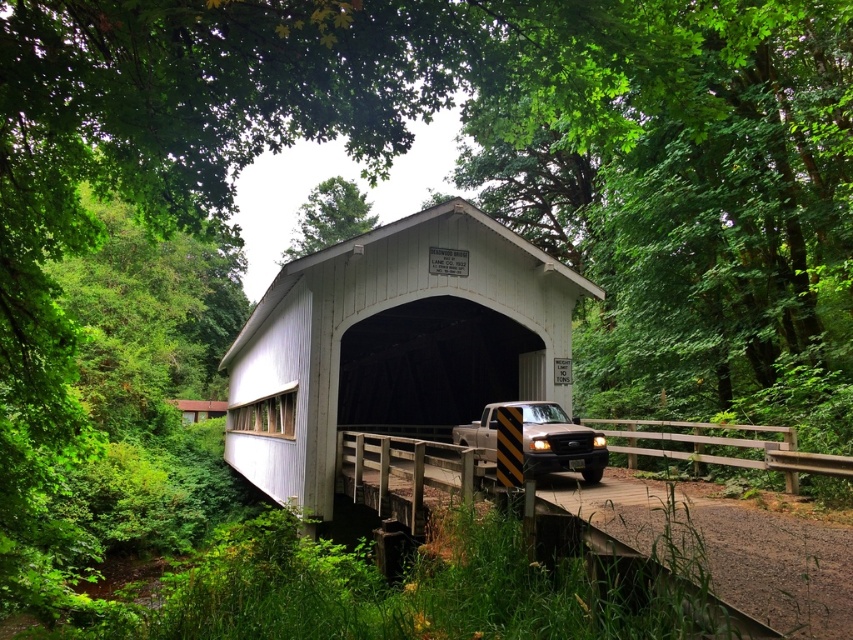
Who is higher up, white corrugated metal overpass at center or brown matte truck at center?

Positioned higher is brown matte truck at center.

Is white corrugated metal overpass at center further to camera compared to brown matte truck at center?

Yes, it is.

Between point (442, 372) and point (538, 420), which one is positioned behind?

Positioned behind is point (442, 372).

At what (x,y) coordinates should I click in order to perform the action: click on white corrugated metal overpass at center. Please return your answer as a coordinate pair (x, y). This screenshot has height=640, width=853. Looking at the image, I should click on (393, 342).